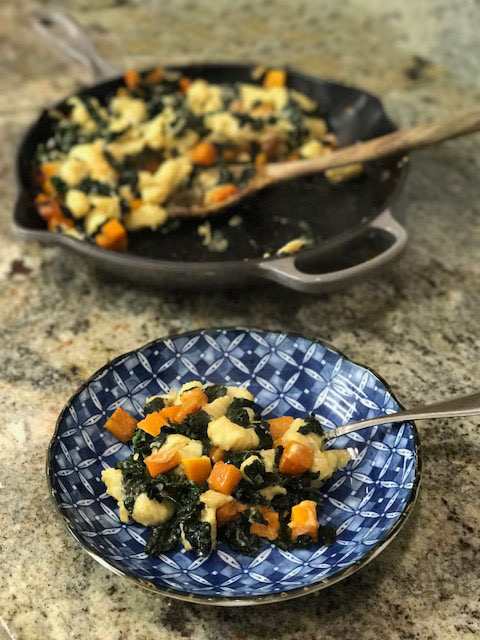
Find the location of a particular element. cooked food is located at coordinates (226, 447), (195, 131).